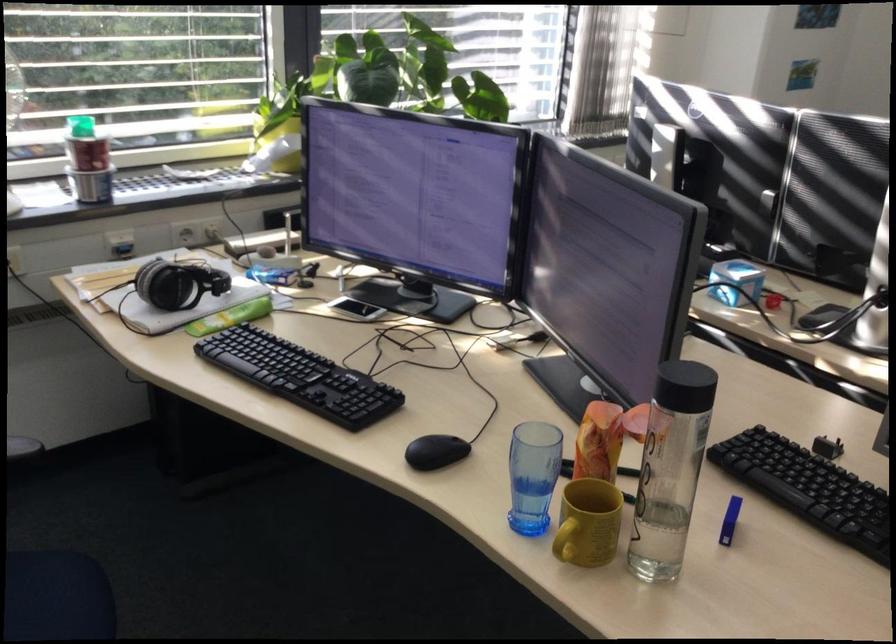
This screenshot has width=896, height=644. Identify the location of green container lid. (81, 126).